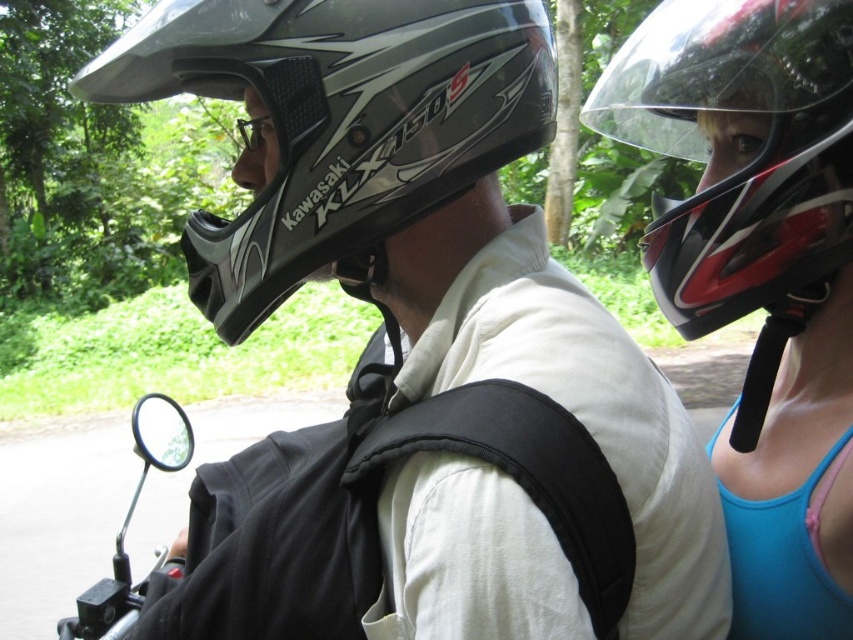
You are a photographer trying to capture the shiny metallic helmet at center. You are currently standing at point (x=338, y=124). Can you confirm if you are directly at the location of the helmet?

Yes, you are directly at the location of the shiny metallic helmet at center because you are standing at point (x=338, y=124) where the helmet is located.

You are a photographer aiming to capture a closeup of the black fabric strap at center while maintaining focus on the motorcycle rider. Given that your camera can focus on objects within 24 inches, will you need to adjust your position to ensure both the strap and rider are in focus?

The black fabric strap at center is 26.58 inches away from the camera, which is beyond the camera focus range of 24 inches. Therefore, you need to move closer to ensure both the strap and rider are in focus.

You are a photographer trying to capture both the shiny metallic helmet at center and the shiny black helmet at upper right in a single shot. The camera you are using has a maximum focus range of 12 inches. Can you fit both helmets in the frame without moving the camera?

The shiny metallic helmet at center and the shiny black helmet at upper right are 12.55 inches apart. Since the distance between them exceeds the camera maximum focus range of 12 inches, you cannot fit both helmets in the frame without moving the camera.